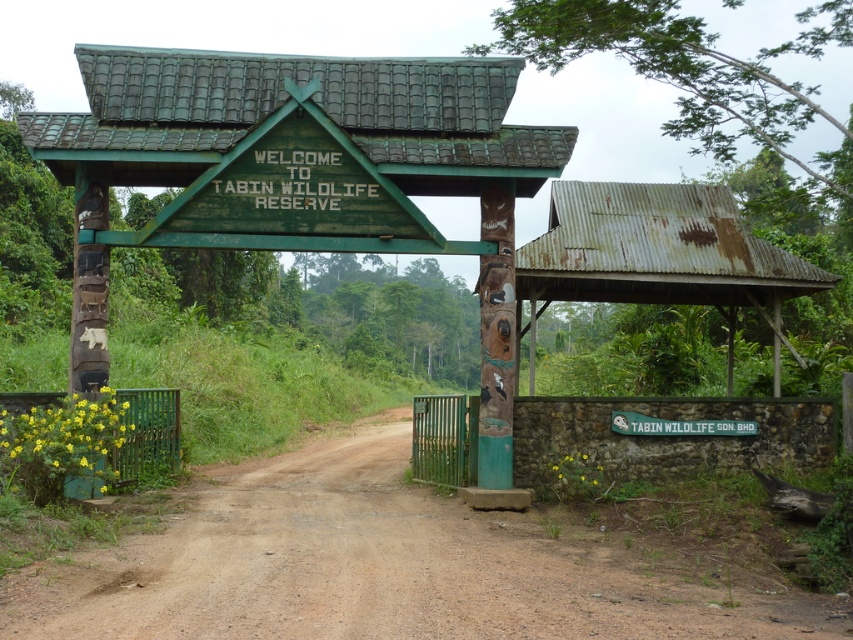
Does brown dirt track at center have a lesser width compared to white plastic sign at center?

Incorrect, brown dirt track at center's width is not less than white plastic sign at center's.

Who is positioned more to the left, brown dirt track at center or white plastic sign at center?

Positioned to the left is brown dirt track at center.

Is point (392, 529) behind point (708, 424)?

No, it is not.

I want to click on brown dirt track at center, so click(x=398, y=564).

Between point (728, 275) and point (616, 422), which one is positioned behind?

The point (728, 275) is more distant.

How far apart are rusty corrugated metal hut at right and white plastic sign at center?

rusty corrugated metal hut at right and white plastic sign at center are 2.15 meters apart.

The image size is (853, 640). I want to click on rusty corrugated metal hut at right, so click(657, 252).

Locate an element on the screen. The width and height of the screenshot is (853, 640). rusty corrugated metal hut at right is located at coordinates (657, 252).

Is rusty corrugated metal hut at center taller than rusty corrugated metal hut at right?

Incorrect, rusty corrugated metal hut at center's height is not larger of rusty corrugated metal hut at right's.

Is point (254, 120) closer to camera compared to point (618, 272)?

Yes, point (254, 120) is closer to viewer.

Between point (491, 344) and point (741, 304), which one is positioned in front?

Point (491, 344) is more forward.

This screenshot has width=853, height=640. In order to click on rusty corrugated metal hut at center in this screenshot , I will do `click(300, 173)`.